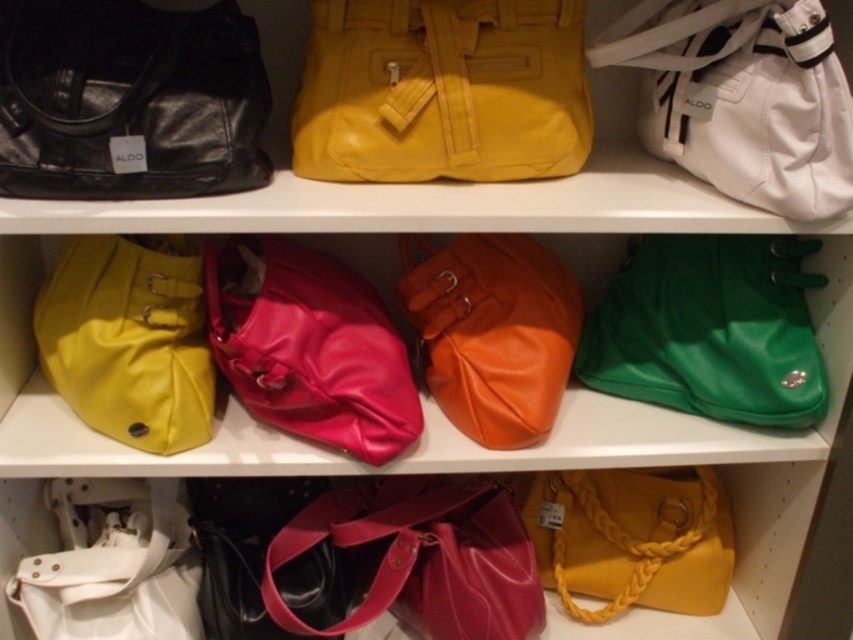
Question: Which point is closer to the camera?

Choices:
 (A) glossy leather handbag at center
 (B) matte yellow leather handbag at upper center

Answer: (B)

Question: Can you confirm if glossy leather handbag at center is positioned to the right of orange leather handbag at center?

Choices:
 (A) yes
 (B) no

Answer: (B)

Question: Is white leather handbag at lower left bigger than yellow woven handbag at lower right?

Choices:
 (A) yes
 (B) no

Answer: (B)

Question: From the image, what is the correct spatial relationship of shiny pink purse at center in relation to white leather handbag at lower left?

Choices:
 (A) below
 (B) above

Answer: (B)

Question: Considering the real-world distances, which object is closest to the glossy leather handbag at center?

Choices:
 (A) matte yellow leather handbag at upper center
 (B) white synthetic tote at upper right
 (C) shiny pink purse at center

Answer: (C)

Question: Which is farther from the white synthetic tote at upper right?

Choices:
 (A) orange leather handbag at center
 (B) matte yellow handbag at upper left

Answer: (B)